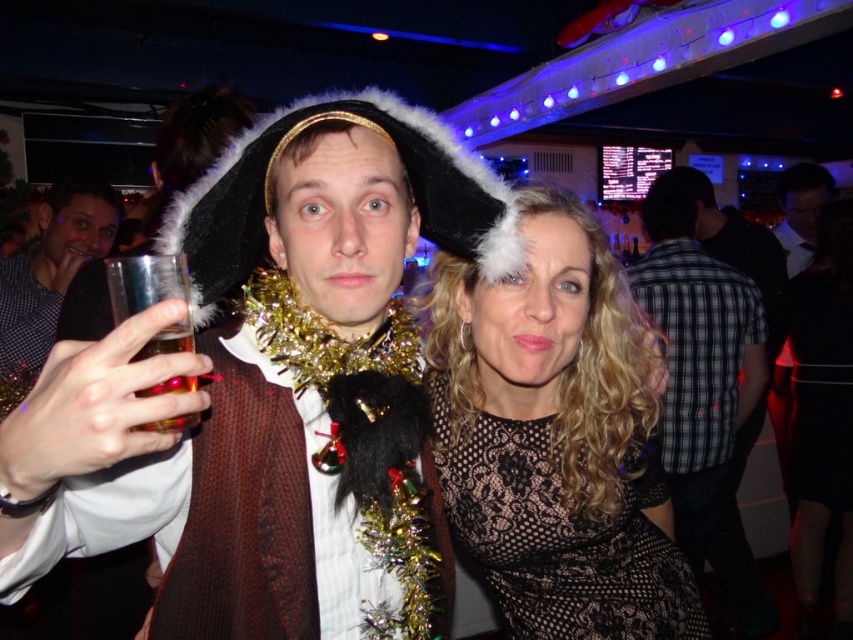
Is checkered fabric shirt at center below clear plastic cup at left?

Yes.

Between point (662, 291) and point (16, 330), which one is positioned behind?

Point (662, 291)

Find the location of a particular element. This screenshot has width=853, height=640. checkered fabric shirt at center is located at coordinates (697, 358).

Does checkered fabric shirt at center have a greater width compared to translucent glass at upper left?

Indeed, checkered fabric shirt at center has a greater width compared to translucent glass at upper left.

This screenshot has width=853, height=640. What do you see at coordinates (697, 358) in the screenshot?
I see `checkered fabric shirt at center` at bounding box center [697, 358].

Locate an element on the screen. This screenshot has height=640, width=853. checkered fabric shirt at center is located at coordinates (697, 358).

Does black lace dress at center come behind clear plastic cup at left?

No, it is in front of clear plastic cup at left.

Which is above, black lace dress at center or clear plastic cup at left?

Positioned higher is clear plastic cup at left.

Which is in front, point (692, 605) or point (38, 288)?

Point (692, 605)

Where is `black lace dress at center`? This screenshot has width=853, height=640. black lace dress at center is located at coordinates (555, 440).